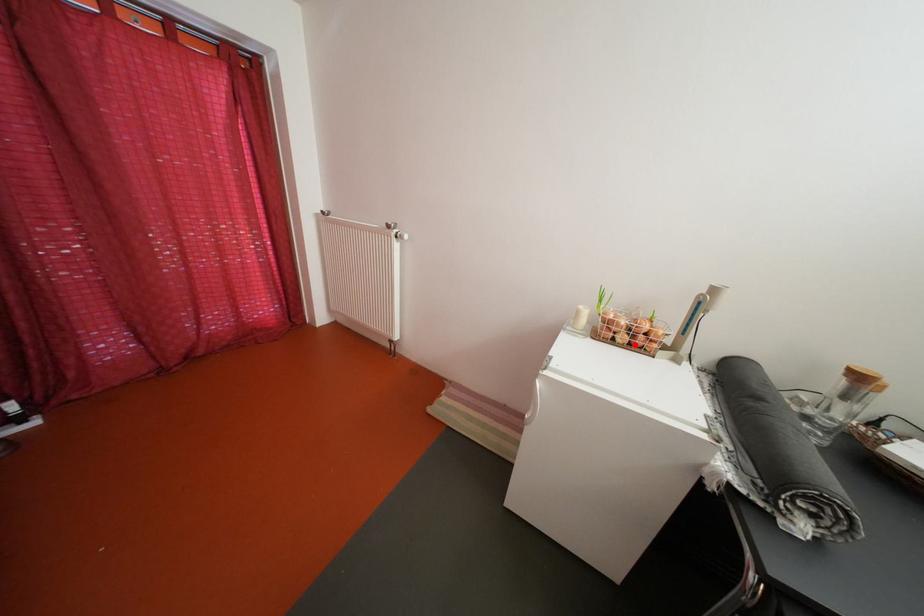
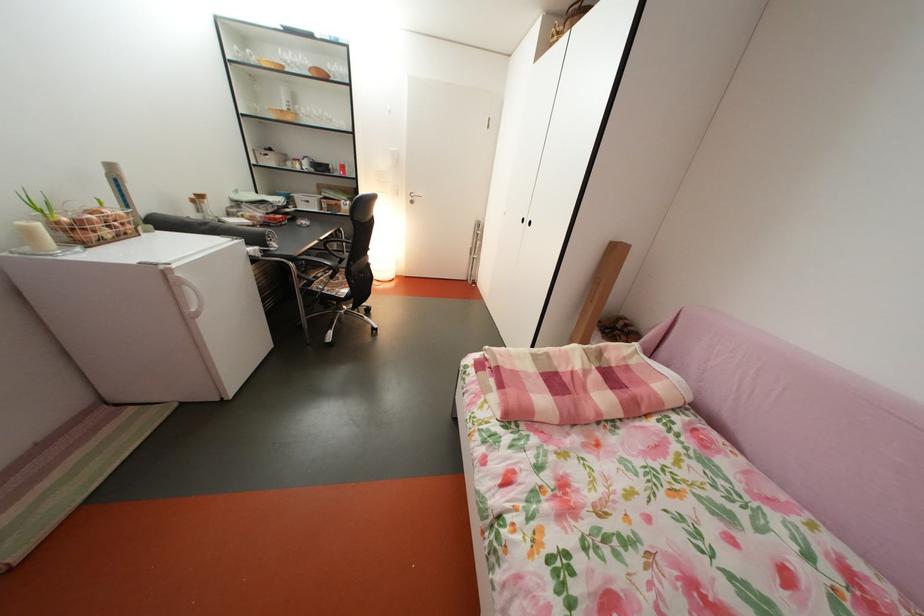
Where in the second image is the point corresponding to the highlighted location from the first image?

(118, 238)